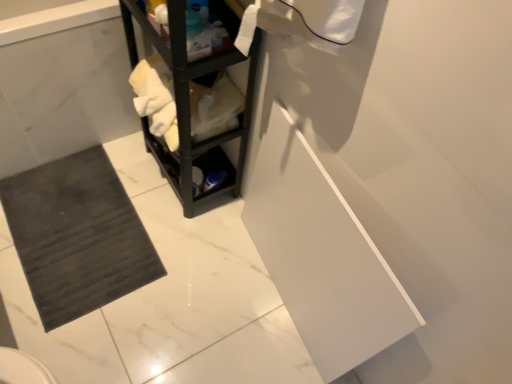
This screenshot has width=512, height=384. I want to click on vacant space in between dark gray rubber bath mat at lower left and black matte shelf at center, so click(109, 182).